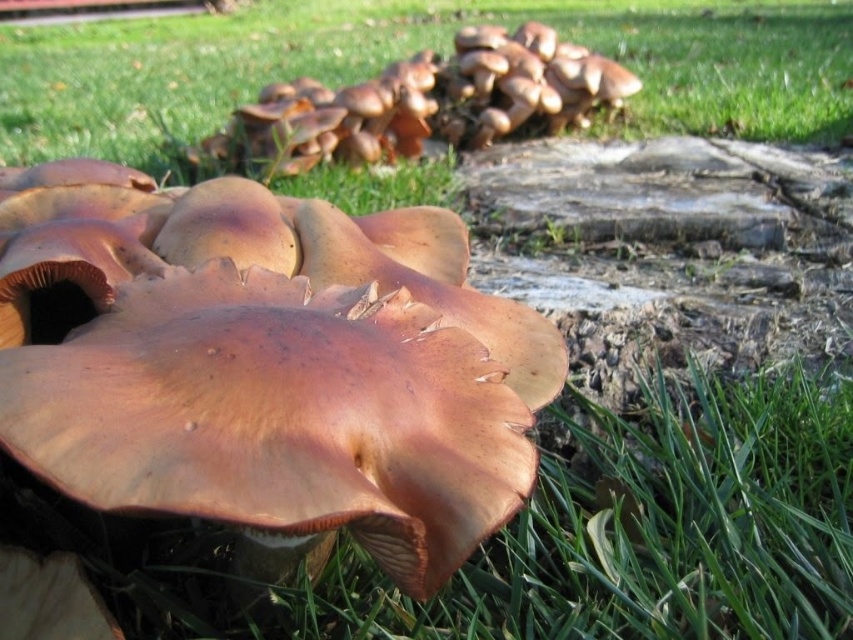
Between point (129, 490) and point (257, 122), which one is positioned behind?

Positioned behind is point (257, 122).

What are the coordinates of `brown matte fungi at center` in the screenshot? It's located at (265, 365).

Identify the location of brown matte fungi at center. (265, 365).

Is point (281, 4) positioned in front of point (508, 84)?

No, it is not.

Identify the location of brown grass at center. Image resolution: width=853 pixels, height=640 pixels. pos(407,54).

Does brown matte fungi at center appear over brown grass at center?

No.

Which is in front, point (149, 276) or point (538, 12)?

Point (149, 276) is more forward.

Find the location of a particular element. This screenshot has height=640, width=853. brown matte fungi at center is located at coordinates [265, 365].

Identify the location of brown matte fungi at center. This screenshot has width=853, height=640. (265, 365).